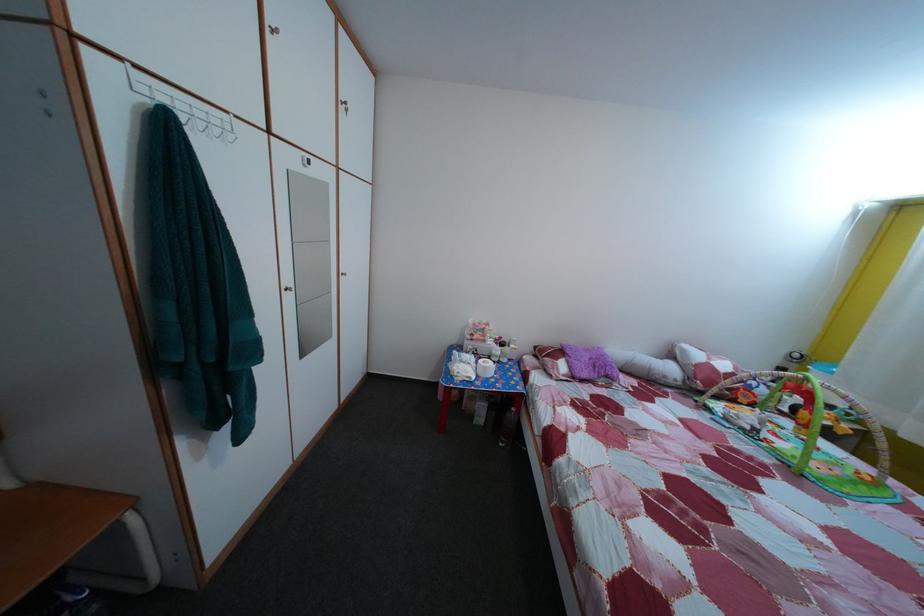
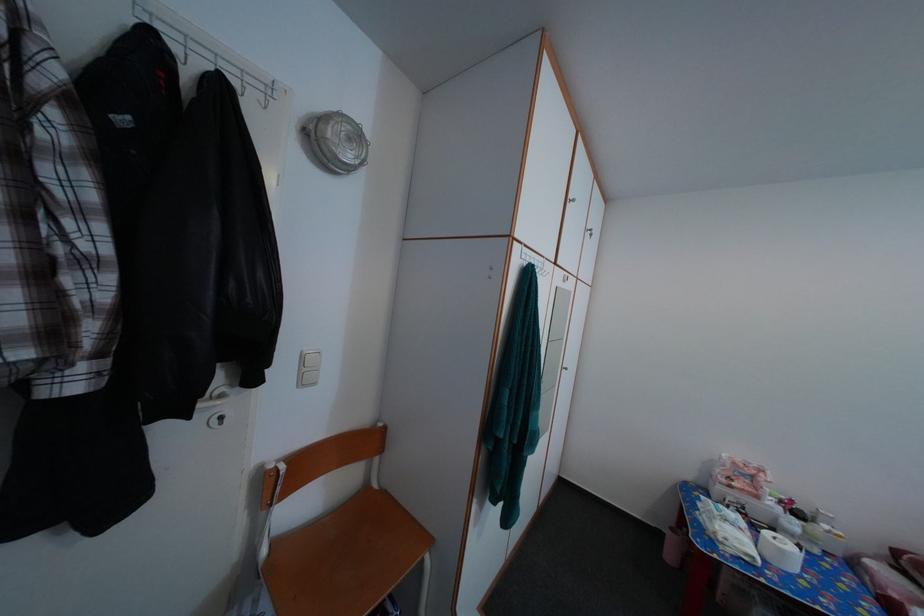
The first image is from the beginning of the video and the second image is from the end. How did the camera likely rotate when shooting the video?

The camera rotated toward left-up.